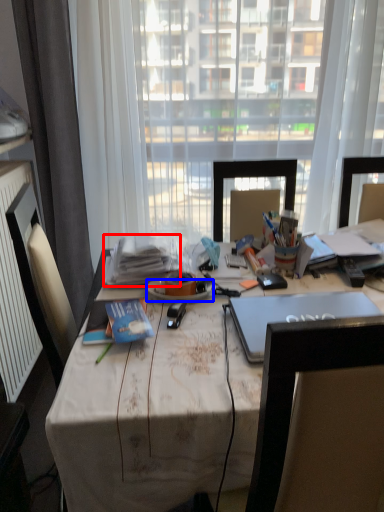
Question: Which of the following is the closest to the observer, book (highlighted by a red box) or plate (highlighted by a blue box)?

Choices:
 (A) book
 (B) plate

Answer: (B)